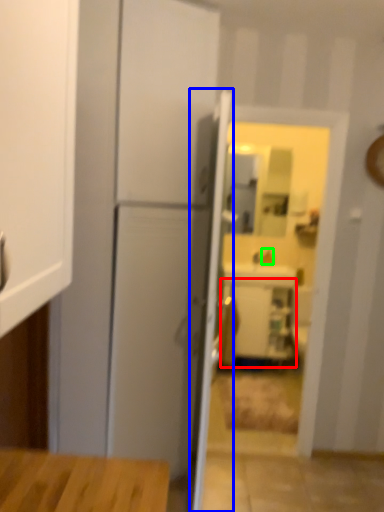
Question: Which object is positioned closest to cabinetry (highlighted by a red box)? Select from door (highlighted by a blue box) and faucet (highlighted by a green box).

Choices:
 (A) door
 (B) faucet

Answer: (B)